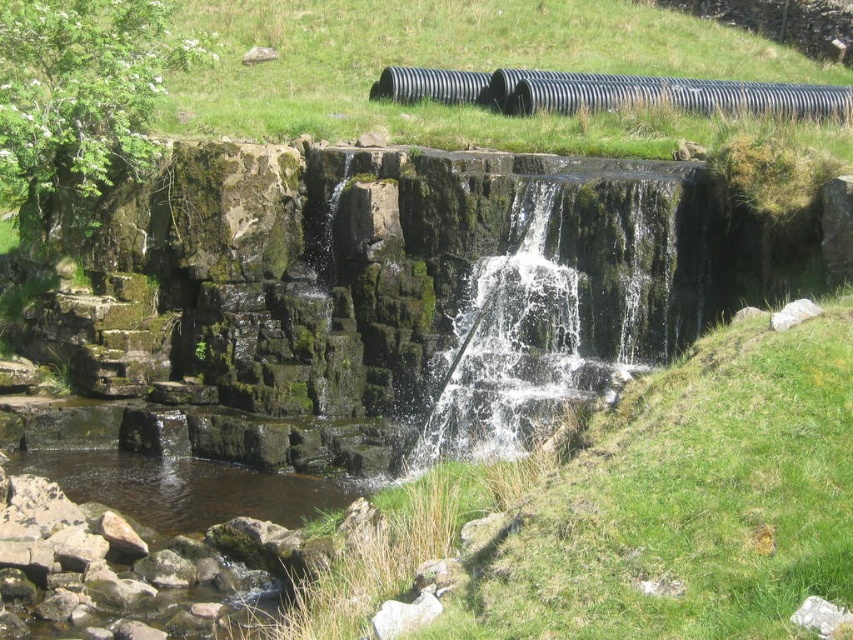
You are planning to cross the stream shown in the image. You have two options to cross the water. One is the clear water at center and the other is the clear water at lower left. Based on their sizes, which area would be more stable for crossing?

The clear water at center is larger in size than the clear water at lower left, so the clear water at center would be more stable for crossing.

You are a hiker who needs to cross the stream at the clear water at lower left to reach the black rubber water pipe at upper center. The stream is 1.2 meters deep. Can you safely cross the stream if you are wearing waterproof boots?

The clear water at lower left is 19.37 meters away from the black rubber water pipe at upper center. Since the stream is only 1.2 meters deep, it may be possible to cross it safely with waterproof boots, but the distance is quite far and requires careful navigation.

You are a hiker who wants to cross the stream at the lower left. You see the clear water at lower left and the black rubber water pipe at upper center. Which object is bigger in size?

The clear water at lower left is smaller than the black rubber water pipe at upper center, so the black rubber water pipe at upper center is bigger in size.